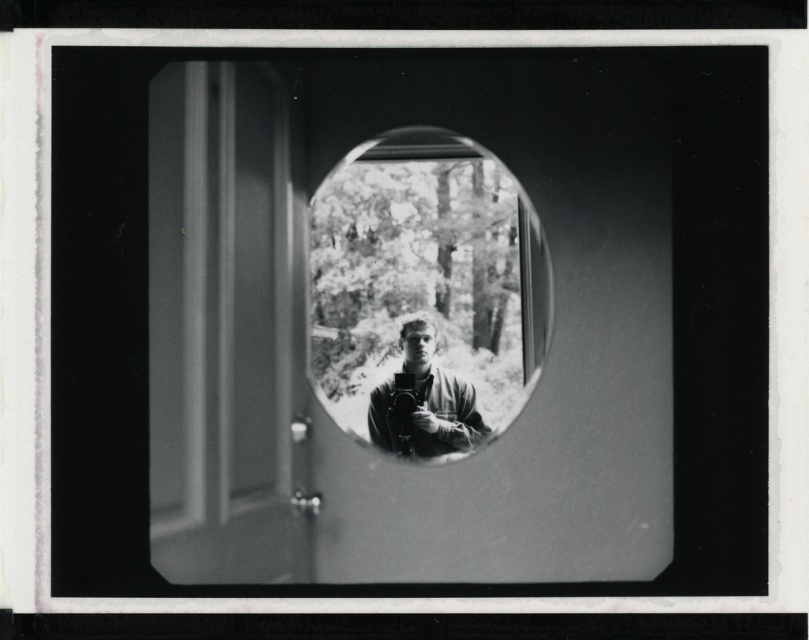
Question: Is smooth glass mirror at center below smooth black camera at center?

Choices:
 (A) no
 (B) yes

Answer: (A)

Question: Among these objects, which one is farthest from the camera?

Choices:
 (A) smooth black camera at center
 (B) smooth glass mirror at center

Answer: (A)

Question: Which of the following is the farthest from the observer?

Choices:
 (A) smooth black camera at center
 (B) smooth glass mirror at center

Answer: (A)

Question: Does smooth glass mirror at center appear under smooth black camera at center?

Choices:
 (A) no
 (B) yes

Answer: (A)

Question: Does smooth glass mirror at center have a lesser width compared to smooth black camera at center?

Choices:
 (A) no
 (B) yes

Answer: (A)